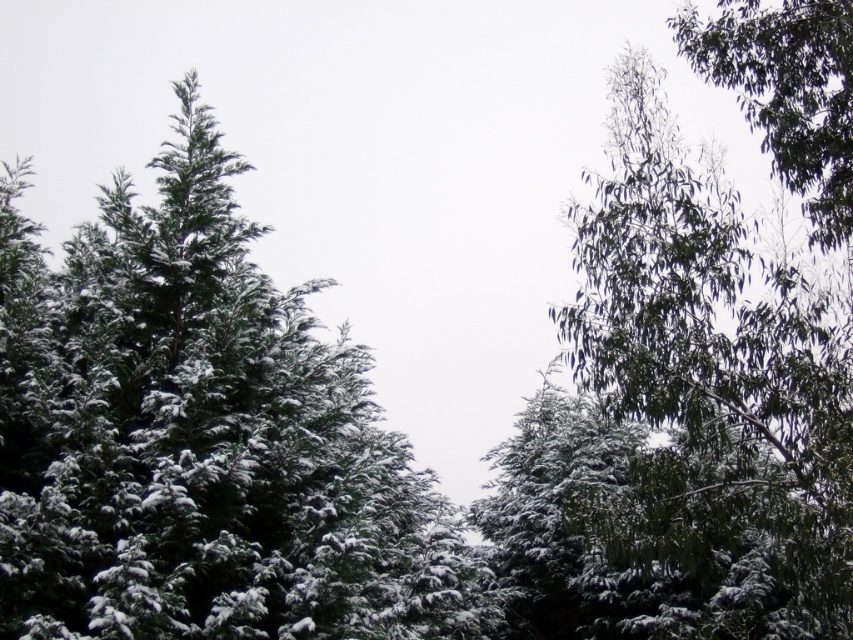
You are standing in the winter scene and want to walk from the point closer to you to the point further away. Which path would you take between the two points, point [277,540] and point [767,115]?

You should take the path from point [277,540] to point [767,115] because point [277,540] is closer to the viewer, so moving towards point [767,115] would be going away from your current position.